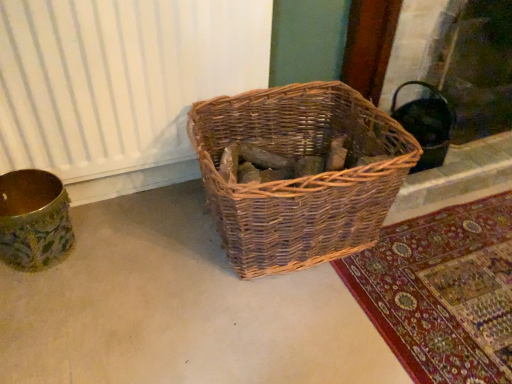
Image resolution: width=512 pixels, height=384 pixels. What are the coordinates of `free point to the right of gold textured vase at left` in the screenshot? It's located at (110, 250).